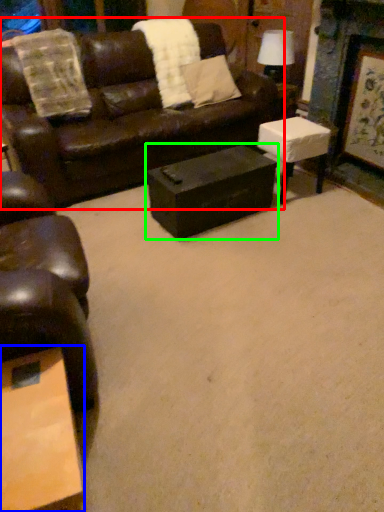
Question: Which object is the farthest from studio couch (highlighted by a red box)? Choose among these: coffee table (highlighted by a blue box) or table (highlighted by a green box).

Choices:
 (A) coffee table
 (B) table

Answer: (A)